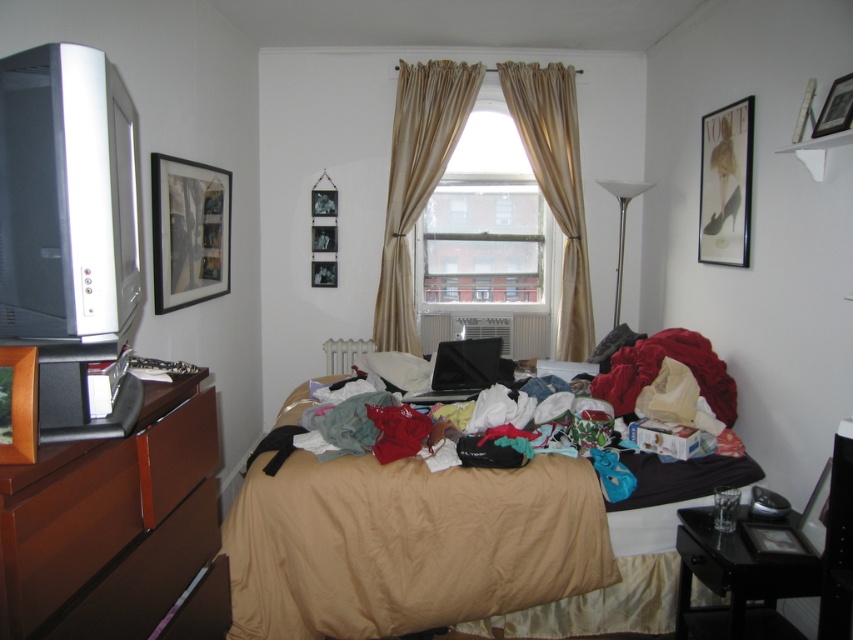
You are standing in the bedroom and want to hang a new picture on the wall behind the multicolored fabric bed at center and the beige silk curtains at upper center. Is there enough space to hang the picture there?

The multicolored fabric bed at center is in front of the beige silk curtains at upper center, so there is space behind the bed to hang the new picture on the wall.

You are organizing the bedroom and need to place a new decorative item between the multicolored fabric at center and the metallic silver picture frame at upper right. Based on their positions, where should you place the new item?

The multicolored fabric at center is positioned on the left side of metallic silver picture frame at upper right, so you should place the new item between them to the right of the multicolored fabric at center and to the left of the metallic silver picture frame at upper right.

You are trying to decide whether to place a new piece of furniture in the bedroom. The furniture is 1.5 meters wide. Based on the image, can you determine if there is enough space between the multicolored fabric bed at center and the beige silk curtains at upper center to fit the new furniture?

The multicolored fabric bed at center might be wider than beige silk curtains at upper center, so there may not be enough space to fit the new furniture between them. Check the exact measurements before deciding.